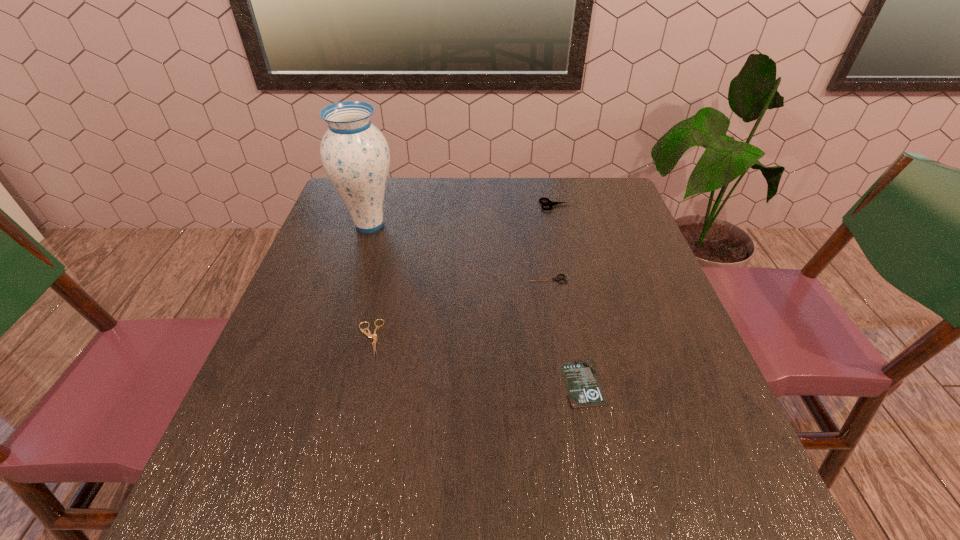
This screenshot has width=960, height=540. Identify the location of vacant region that satisfies the following two spatial constraints: 1. on the back side of the nearest shears; 2. on the left side of the second tallest object. (x=401, y=205).

You are a GUI agent. You are given a task and a screenshot of the screen. Output one action in this format:
    pyautogui.click(x=<x>, y=<y>)
    Task: Click on the free space that satisfies the following two spatial constraints: 1. on the back side of the second nearest shears; 2. on the right side of the second tallest object
    The width and height of the screenshot is (960, 540).
    Given the screenshot: What is the action you would take?
    pyautogui.click(x=535, y=205)